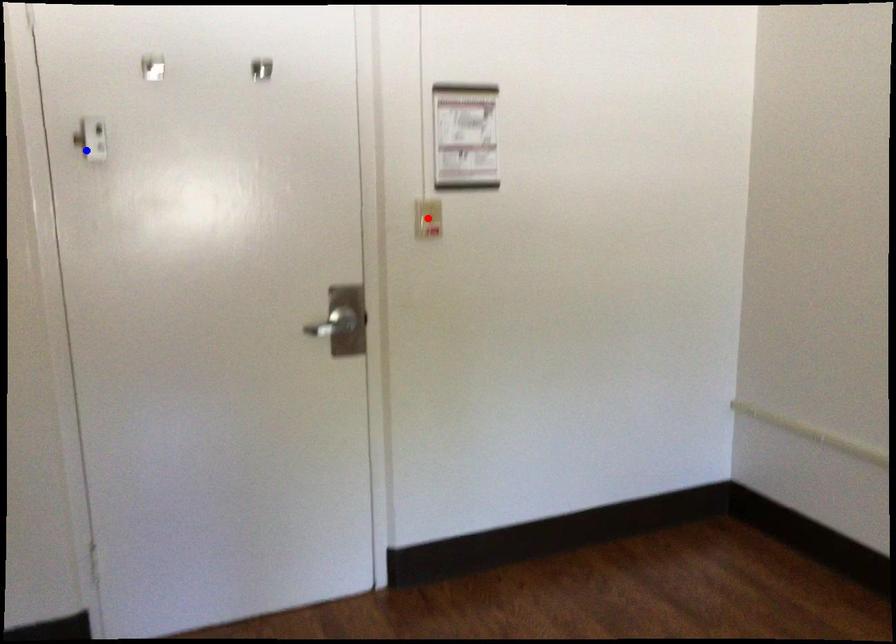
Question: In the image, two points are highlighted. Which point is nearer to the camera? Reply with the corresponding letter.

Choices:
 (A) blue point
 (B) red point

Answer: (A)